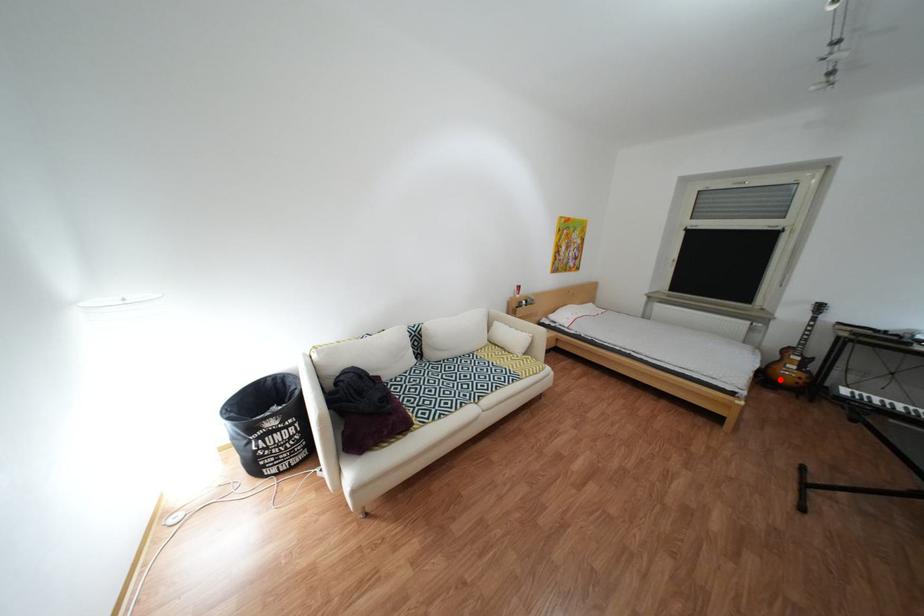
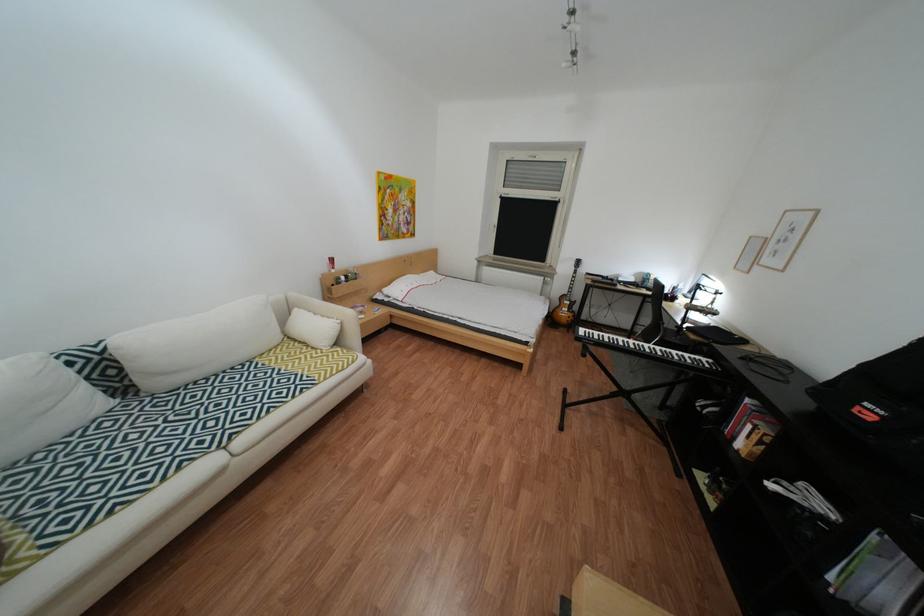
Locate, in the second image, the point that corresponds to the highlighted location in the first image.

(566, 323)